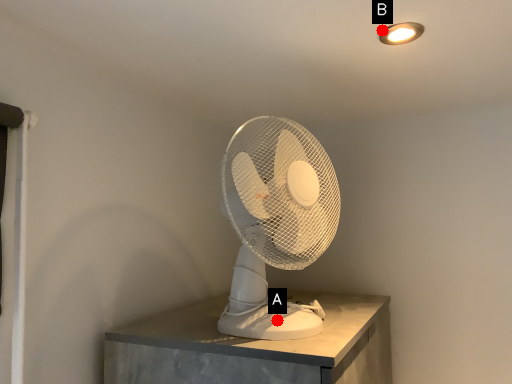
Question: Two points are circled on the image, labeled by A and B beside each circle. Which point is closer to the camera?

Choices:
 (A) A is closer
 (B) B is closer

Answer: (B)